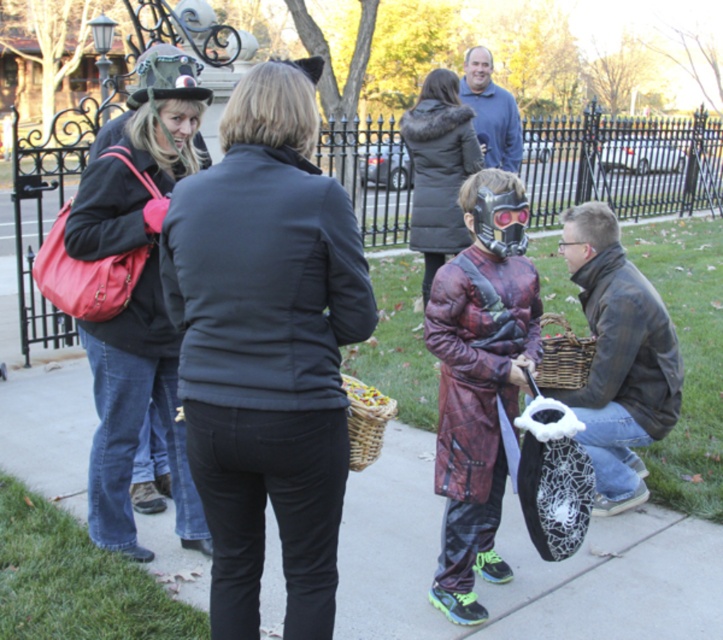
Question: Which object appears closest to the camera in this image?

Choices:
 (A) leather jacket at lower right
 (B) matte black jacket at center
 (C) black fur-trimmed coat at center
 (D) red plaid coat at center

Answer: (B)

Question: Is red plaid coat at center to the left of leather jacket at lower right from the viewer's perspective?

Choices:
 (A) no
 (B) yes

Answer: (B)

Question: Can you confirm if matte black jacket at left is smaller than black fur-trimmed coat at center?

Choices:
 (A) yes
 (B) no

Answer: (A)

Question: Which point is farther to the camera?

Choices:
 (A) black fur-trimmed coat at center
 (B) leather jacket at lower right
 (C) matte black jacket at center

Answer: (A)

Question: Is red plaid coat at center below leather jacket at lower right?

Choices:
 (A) no
 (B) yes

Answer: (B)

Question: Which point appears closest to the camera in this image?

Choices:
 (A) (442, 100)
 (B) (455, 449)
 (C) (124, 403)

Answer: (B)